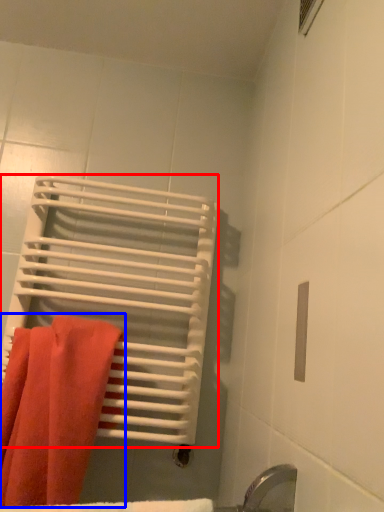
Question: Among these objects, which one is nearest to the camera, bath towel (highlighted by a red box) or towel (highlighted by a blue box)?

Choices:
 (A) bath towel
 (B) towel

Answer: (B)